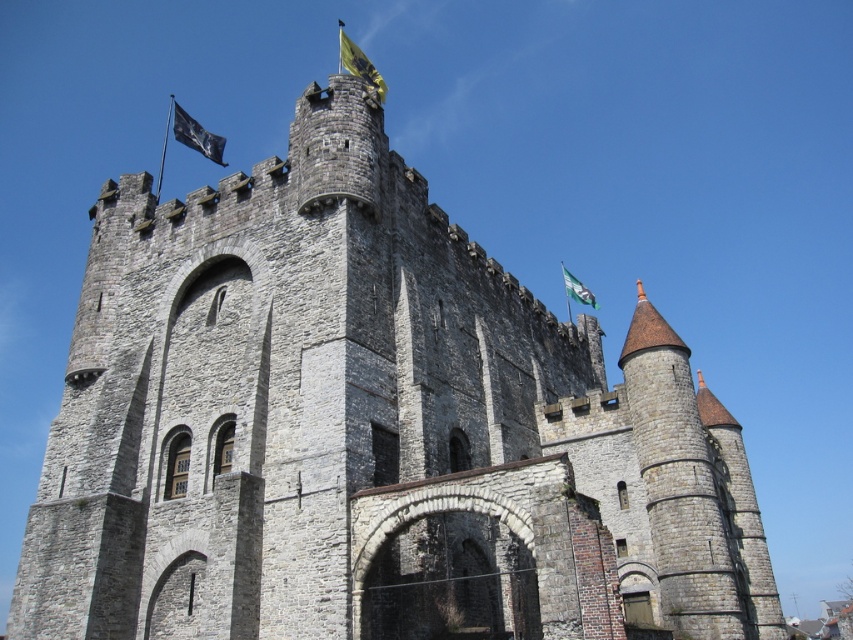
You are a knight standing in the courtyard of the castle. You notice two flags flying on the towers. Which flag is higher up between the black fabric flag at upper left and the white fabric flag at upper right?

The black fabric flag at upper left is higher up because it is positioned above the white fabric flag at upper right.

Looking at this image, you are a knight standing at the base of the main tower in the medieval stone castle. You need to locate the black fabric flag at upper left. Based on the coordinates provided, can you determine its position relative to the main tower?

The black fabric flag at upper left is located at coordinates point (196, 134), which places it to the left side and slightly above the main tower in the image.

Looking at this image, you are a medieval knight standing at the base of the castle. You need to determine if you can safely throw a rope between the black fabric flag at upper left and the white fabric flag at upper right. The rope you have is 100 meters long. Can you make the throw?

The distance between the black fabric flag at upper left and the white fabric flag at upper right is 101.87 meters, which is longer than the 100 meter rope. Therefore, the knight cannot safely throw the rope between them.